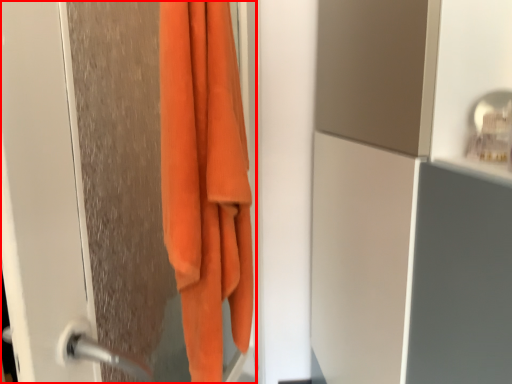
Question: From the image's perspective, where is screen door (annotated by the red box) located relative to towel?

Choices:
 (A) above
 (B) below

Answer: (B)